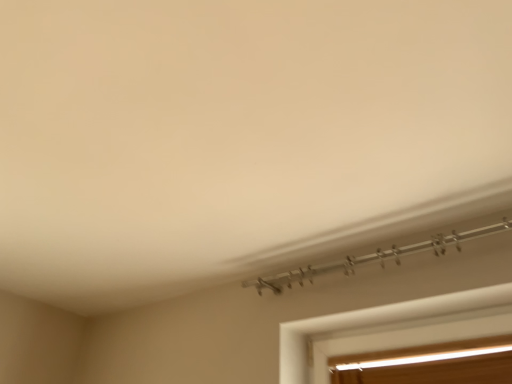
Image resolution: width=512 pixels, height=384 pixels. What do you see at coordinates (429, 364) in the screenshot? I see `clear glass window at lower right, the second window in the top-to-bottom sequence` at bounding box center [429, 364].

Locate an element on the screen. clear glass window at lower right, the second window in the top-to-bottom sequence is located at coordinates (429, 364).

Measure the distance between point (294, 340) and camera.

A distance of 5.60 feet exists between point (294, 340) and camera.

In order to click on white matte window at lower right, which ranks as the second window in bottom-to-top order in this screenshot , I will do `click(375, 323)`.

Describe the element at coordinates (375, 323) in the screenshot. I see `white matte window at lower right, the 1th window in the top-to-bottom sequence` at that location.

Locate an element on the screen. The width and height of the screenshot is (512, 384). clear glass window at lower right, the second window in the top-to-bottom sequence is located at coordinates (429, 364).

In the image, is clear glass window at lower right, the second window in the top-to-bottom sequence, on the left side or the right side of white matte window at lower right, the 1th window in the top-to-bottom sequence?

In the image, clear glass window at lower right, the second window in the top-to-bottom sequence, appears on the right side of white matte window at lower right, the 1th window in the top-to-bottom sequence.

Between clear glass window at lower right, the second window in the top-to-bottom sequence, and white matte window at lower right, which ranks as the second window in bottom-to-top order, which one is positioned behind?

clear glass window at lower right, the second window in the top-to-bottom sequence, is behind.

Consider the image. Which is farther from the camera, (x=410, y=372) or (x=290, y=346)?

The point (x=290, y=346) is behind.

From the image's perspective, is clear glass window at lower right, the second window in the top-to-bottom sequence, located above or below white matte window at lower right, which ranks as the second window in bottom-to-top order?

Clearly, from the image's perspective, clear glass window at lower right, the second window in the top-to-bottom sequence, is below white matte window at lower right, which ranks as the second window in bottom-to-top order.

Looking at this image, from a real-world perspective, between clear glass window at lower right, which ranks as the 1th window in bottom-to-top order, and white matte window at lower right, which ranks as the second window in bottom-to-top order, who is vertically lower?

In real-world perspective, clear glass window at lower right, which ranks as the 1th window in bottom-to-top order, is lower.

Between clear glass window at lower right, which ranks as the 1th window in bottom-to-top order, and white matte window at lower right, which ranks as the second window in bottom-to-top order, which one has smaller width?

clear glass window at lower right, which ranks as the 1th window in bottom-to-top order.

Considering the sizes of clear glass window at lower right, the second window in the top-to-bottom sequence, and white matte window at lower right, which ranks as the second window in bottom-to-top order, in the image, is clear glass window at lower right, the second window in the top-to-bottom sequence, taller or shorter than white matte window at lower right, which ranks as the second window in bottom-to-top order,?

clear glass window at lower right, the second window in the top-to-bottom sequence, is taller than white matte window at lower right, which ranks as the second window in bottom-to-top order.

Which of these two, clear glass window at lower right, which ranks as the 1th window in bottom-to-top order, or white matte window at lower right, which ranks as the second window in bottom-to-top order, is smaller?

Smaller between the two is white matte window at lower right, which ranks as the second window in bottom-to-top order.

Is clear glass window at lower right, the second window in the top-to-bottom sequence, not within white matte window at lower right, which ranks as the second window in bottom-to-top order?

That's correct, clear glass window at lower right, the second window in the top-to-bottom sequence, is outside of white matte window at lower right, which ranks as the second window in bottom-to-top order.

Does clear glass window at lower right, the second window in the top-to-bottom sequence, touch white matte window at lower right, which ranks as the second window in bottom-to-top order?

They are not placed beside each other.

Looking at this image, is clear glass window at lower right, which ranks as the 1th window in bottom-to-top order, oriented away from white matte window at lower right, which ranks as the second window in bottom-to-top order?

No, clear glass window at lower right, which ranks as the 1th window in bottom-to-top order, is not facing the opposite direction of white matte window at lower right, which ranks as the second window in bottom-to-top order.

Could you measure the distance between clear glass window at lower right, the second window in the top-to-bottom sequence, and white matte window at lower right, which ranks as the second window in bottom-to-top order?

clear glass window at lower right, the second window in the top-to-bottom sequence, and white matte window at lower right, which ranks as the second window in bottom-to-top order, are 6.36 inches apart from each other.

Where is `window that is in front of the clear glass window at lower right, the second window in the top-to-bottom sequence`? This screenshot has height=384, width=512. window that is in front of the clear glass window at lower right, the second window in the top-to-bottom sequence is located at coordinates (375, 323).

Does white matte window at lower right, which ranks as the second window in bottom-to-top order, appear on the left side of clear glass window at lower right, the second window in the top-to-bottom sequence?

Yes.

From the picture: In the image, is white matte window at lower right, the 1th window in the top-to-bottom sequence, positioned in front of or behind clear glass window at lower right, which ranks as the 1th window in bottom-to-top order?

Visually, white matte window at lower right, the 1th window in the top-to-bottom sequence, is located in front of clear glass window at lower right, which ranks as the 1th window in bottom-to-top order.

Which is farther from the camera, (x=459, y=296) or (x=477, y=342)?

The point (x=477, y=342) is farther.

Consider the image. From the image's perspective, between white matte window at lower right, which ranks as the second window in bottom-to-top order, and clear glass window at lower right, the second window in the top-to-bottom sequence, who is located below?

clear glass window at lower right, the second window in the top-to-bottom sequence, from the image's perspective.

From a real-world perspective, is white matte window at lower right, which ranks as the second window in bottom-to-top order, over clear glass window at lower right, the second window in the top-to-bottom sequence?

Yes, from a real-world perspective, white matte window at lower right, which ranks as the second window in bottom-to-top order, is above clear glass window at lower right, the second window in the top-to-bottom sequence.

Can you confirm if white matte window at lower right, the 1th window in the top-to-bottom sequence, is thinner than clear glass window at lower right, which ranks as the 1th window in bottom-to-top order?

Incorrect, the width of white matte window at lower right, the 1th window in the top-to-bottom sequence, is not less than that of clear glass window at lower right, which ranks as the 1th window in bottom-to-top order.

Is white matte window at lower right, which ranks as the second window in bottom-to-top order, shorter than clear glass window at lower right, the second window in the top-to-bottom sequence?

Correct, white matte window at lower right, which ranks as the second window in bottom-to-top order, is not as tall as clear glass window at lower right, the second window in the top-to-bottom sequence.

Who is smaller, white matte window at lower right, the 1th window in the top-to-bottom sequence, or clear glass window at lower right, which ranks as the 1th window in bottom-to-top order?

white matte window at lower right, the 1th window in the top-to-bottom sequence.

Would you say clear glass window at lower right, which ranks as the 1th window in bottom-to-top order, is part of white matte window at lower right, the 1th window in the top-to-bottom sequence,'s contents?

No, clear glass window at lower right, which ranks as the 1th window in bottom-to-top order, is not surrounded by white matte window at lower right, the 1th window in the top-to-bottom sequence.

From the picture: Is white matte window at lower right, which ranks as the second window in bottom-to-top order, with clear glass window at lower right, which ranks as the 1th window in bottom-to-top order?

white matte window at lower right, which ranks as the second window in bottom-to-top order, and clear glass window at lower right, which ranks as the 1th window in bottom-to-top order, are not in contact.

Could you tell me if white matte window at lower right, the 1th window in the top-to-bottom sequence, is facing clear glass window at lower right, the second window in the top-to-bottom sequence?

No, white matte window at lower right, the 1th window in the top-to-bottom sequence, is not facing towards clear glass window at lower right, the second window in the top-to-bottom sequence.

Consider the image. How far apart are white matte window at lower right, the 1th window in the top-to-bottom sequence, and clear glass window at lower right, which ranks as the 1th window in bottom-to-top order?

white matte window at lower right, the 1th window in the top-to-bottom sequence, and clear glass window at lower right, which ranks as the 1th window in bottom-to-top order, are 6.36 inches apart.

Find the location of a particular element. This screenshot has height=384, width=512. window above the clear glass window at lower right, which ranks as the 1th window in bottom-to-top order (from the image's perspective) is located at coordinates (375, 323).

The image size is (512, 384). What are the coordinates of `window that appears on the right of white matte window at lower right, the 1th window in the top-to-bottom sequence` in the screenshot? It's located at (429, 364).

At what (x,y) coordinates should I click in order to perform the action: click on window directly beneath the white matte window at lower right, which ranks as the second window in bottom-to-top order (from a real-world perspective). Please return your answer as a coordinate pair (x, y). This screenshot has height=384, width=512. Looking at the image, I should click on click(429, 364).